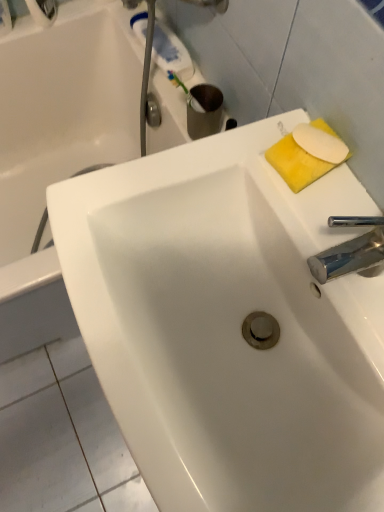
Question: From a real-world perspective, is white glossy sink at center physically below white matte soap at upper right, positioned as the 2th soap in back-to-front order?

Choices:
 (A) no
 (B) yes

Answer: (B)

Question: From the image's perspective, is white glossy sink at center beneath white matte soap at upper right, positioned as the first soap in front-to-back order?

Choices:
 (A) yes
 (B) no

Answer: (A)

Question: From a real-world perspective, is white glossy sink at center positioned over white matte soap at upper right, positioned as the 2th soap in back-to-front order, based on gravity?

Choices:
 (A) no
 (B) yes

Answer: (A)

Question: Can you confirm if white glossy sink at center is bigger than white matte soap at upper right, positioned as the first soap in front-to-back order?

Choices:
 (A) no
 (B) yes

Answer: (B)

Question: Considering the relative sizes of white glossy sink at center and white matte soap at upper right, positioned as the first soap in front-to-back order, in the image provided, is white glossy sink at center wider than white matte soap at upper right, positioned as the first soap in front-to-back order,?

Choices:
 (A) yes
 (B) no

Answer: (A)

Question: From a real-world perspective, is white glossy bathtub at upper left positioned above or below metallic knob at upper center?

Choices:
 (A) below
 (B) above

Answer: (A)

Question: Is white glossy bathtub at upper left spatially inside metallic knob at upper center, or outside of it?

Choices:
 (A) outside
 (B) inside

Answer: (A)

Question: Based on their positions, is white glossy bathtub at upper left located to the left or right of metallic knob at upper center?

Choices:
 (A) left
 (B) right

Answer: (A)

Question: Considering their positions, is white glossy bathtub at upper left located in front of or behind metallic knob at upper center?

Choices:
 (A) behind
 (B) front

Answer: (B)

Question: Considering the positions of yellow sponge at upper right, placed as the 1th soap when sorted from back to front, and white glossy sink at center in the image, is yellow sponge at upper right, placed as the 1th soap when sorted from back to front, wider or thinner than white glossy sink at center?

Choices:
 (A) wide
 (B) thin

Answer: (B)

Question: In the image, is yellow sponge at upper right, which ranks as the second soap in front-to-back order, positioned in front of or behind white glossy sink at center?

Choices:
 (A) behind
 (B) front

Answer: (A)

Question: Is yellow sponge at upper right, placed as the 1th soap when sorted from back to front, taller or shorter than white glossy sink at center?

Choices:
 (A) tall
 (B) short

Answer: (B)

Question: Based on their sizes in the image, would you say yellow sponge at upper right, which ranks as the second soap in front-to-back order, is bigger or smaller than white glossy sink at center?

Choices:
 (A) big
 (B) small

Answer: (B)

Question: From the image's perspective, is white glossy bathtub at upper left above or below yellow sponge at upper right, which ranks as the second soap in front-to-back order?

Choices:
 (A) below
 (B) above

Answer: (B)

Question: Would you say white glossy bathtub at upper left is inside or outside yellow sponge at upper right, which ranks as the second soap in front-to-back order?

Choices:
 (A) outside
 (B) inside

Answer: (A)